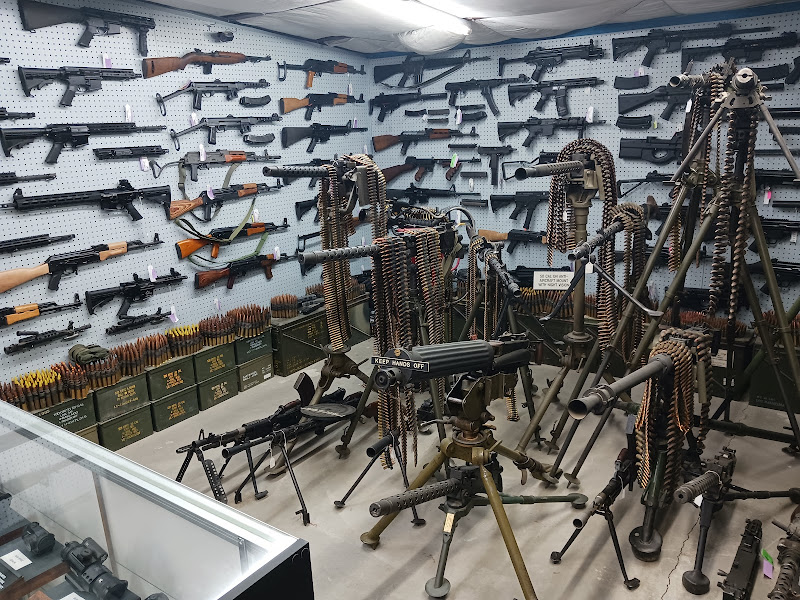
Where is `tan floor`? This screenshot has height=600, width=800. tan floor is located at coordinates (545, 540), (362, 579).